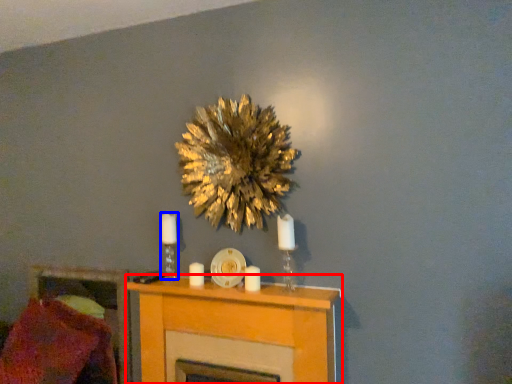
Question: Which object is further to the camera taking this photo, furniture (highlighted by a red box) or candle holder (highlighted by a blue box)?

Choices:
 (A) furniture
 (B) candle holder

Answer: (B)